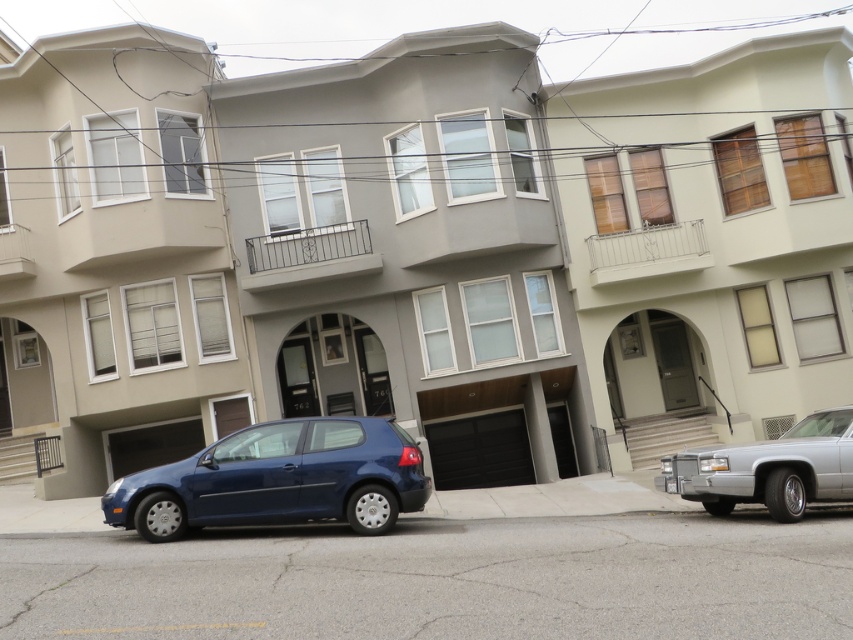
Looking at this image, does matte blue hatchback at center appear under silver metallic sedan at right?

Yes, matte blue hatchback at center is below silver metallic sedan at right.

Who is more distant from viewer, (347,460) or (846,480)?

The point (846,480) is more distant.

Where is `matte blue hatchback at center`? This screenshot has height=640, width=853. matte blue hatchback at center is located at coordinates (277, 480).